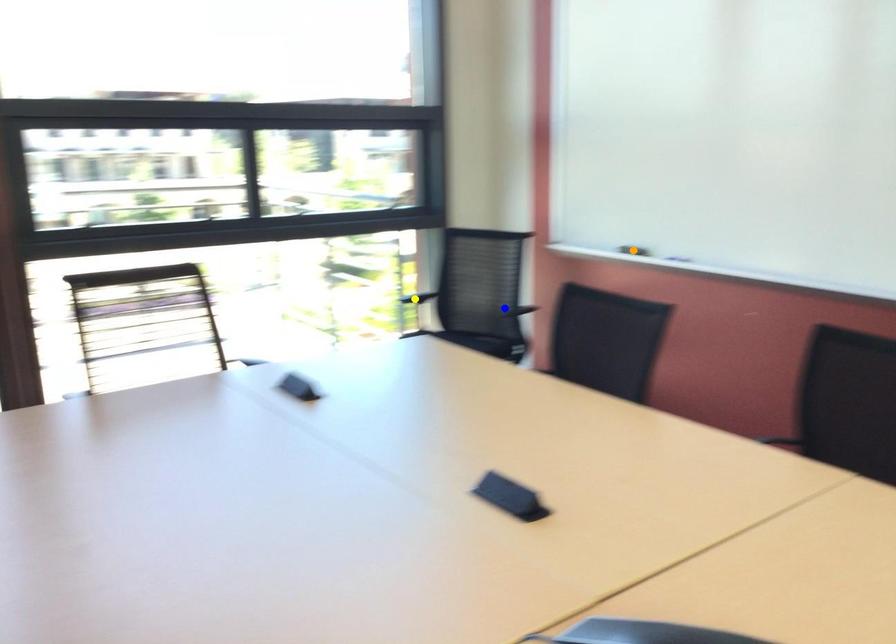
Order these from nearest to farthest:
orange point, blue point, yellow point

yellow point
blue point
orange point